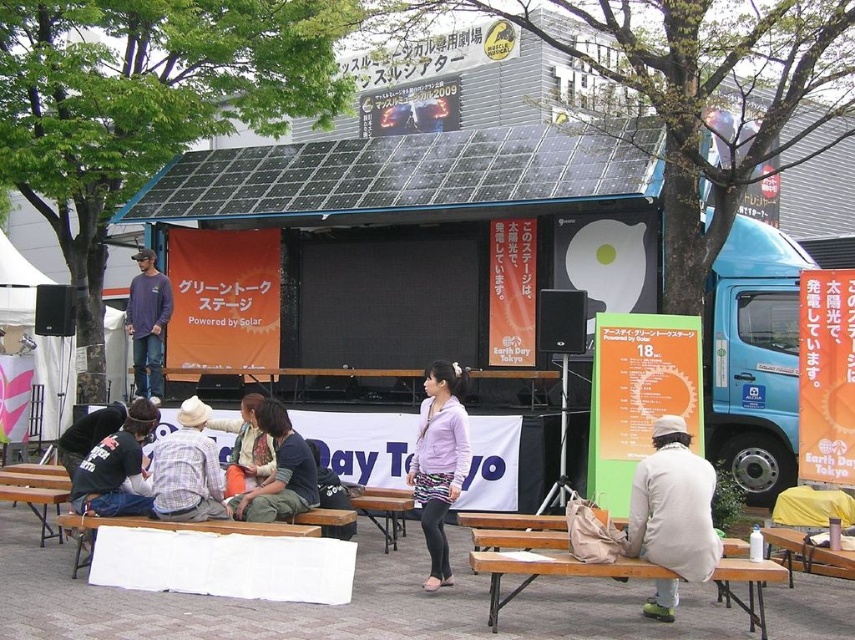
Between point (612, 144) and point (439, 545), which one is positioned in front?

Point (439, 545)

Does black solar panel at center have a lesser height compared to purple matte jacket at center?

Yes, black solar panel at center is shorter than purple matte jacket at center.

Is point (311, 326) behind point (435, 436)?

That is True.

Where is `black solar panel at center`? The height and width of the screenshot is (640, 855). black solar panel at center is located at coordinates (393, 176).

Does black cotton shirt at lower left have a smaller size compared to orange fabric jacket at center?

Correct, black cotton shirt at lower left occupies less space than orange fabric jacket at center.

Find the location of `black cotton shirt at lower left`. black cotton shirt at lower left is located at coordinates 116,468.

What do you see at coordinates (279, 472) in the screenshot? I see `matte black jacket at center` at bounding box center [279, 472].

Locate an element on the screen. This screenshot has height=640, width=855. matte black jacket at center is located at coordinates (279, 472).